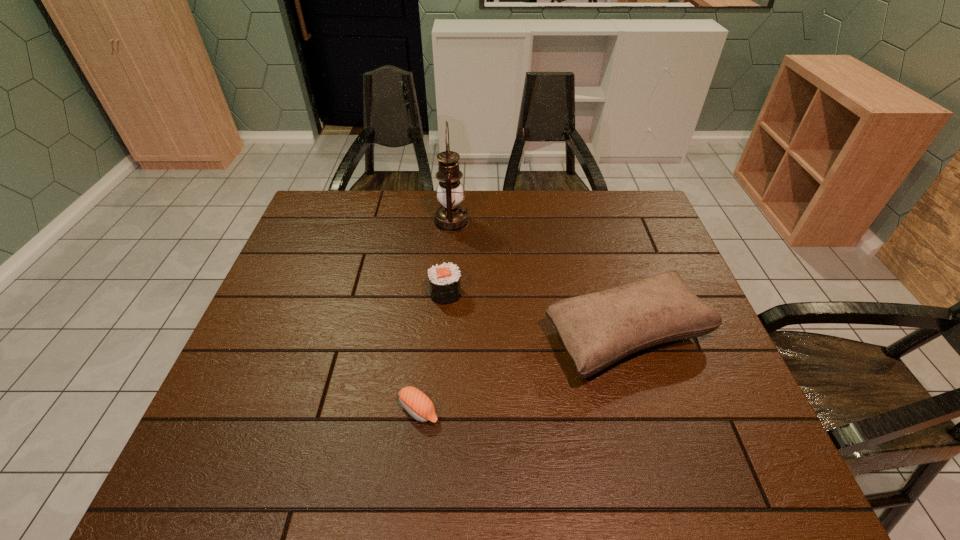
The image size is (960, 540). I want to click on unoccupied position between the shorter sushi and the oil lamp, so click(x=436, y=316).

At what (x,y) coordinates should I click in order to perform the action: click on unoccupied area between the tallest object and the shorter sushi. Please return your answer as a coordinate pair (x, y). Looking at the image, I should click on [x=436, y=316].

I want to click on free space between the cushion and the oil lamp, so click(x=540, y=279).

I want to click on blank region between the second tallest object and the second shortest object, so click(537, 315).

The height and width of the screenshot is (540, 960). I want to click on free point between the taller sushi and the nearer sushi, so click(x=432, y=352).

Image resolution: width=960 pixels, height=540 pixels. Identify the location of vacant area that lies between the rightmost object and the third tallest object. [x=537, y=315].

Identify the location of free space between the second tallest object and the nearest object. (523, 373).

Locate an element on the screen. empty space that is in between the farthest object and the farther sushi is located at coordinates (448, 258).

The width and height of the screenshot is (960, 540). I want to click on vacant area that lies between the nearer sushi and the tallest object, so click(x=436, y=316).

The image size is (960, 540). What are the coordinates of `vacant region between the farthest object and the second shortest object` in the screenshot? It's located at (448, 258).